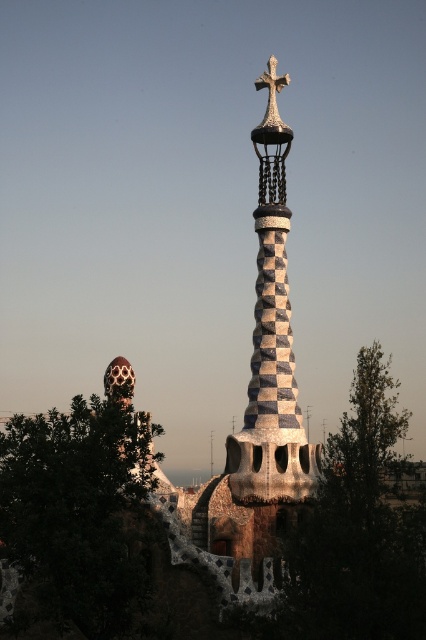
In the scene shown: You are a drone operator tasked with capturing aerial footage of the speckled ceramic spire at center and the white stone cross at upper center. Your drone has a maximum flight range of 60 feet. Can the drone safely capture footage of both objects without exceeding its range?

The speckled ceramic spire at center is 59.64 feet from the white stone cross at upper center. Since the distance is within the drone operator drone has a maximum flight range of 60 feet, the drone can safely capture footage of both objects without exceeding its range.

You are standing in front of the spiraling tower at Park Gell. You notice a point marked at coordinates (271, 349). What does this point indicate?

The point at (271, 349) marks the speckled ceramic spire at center.